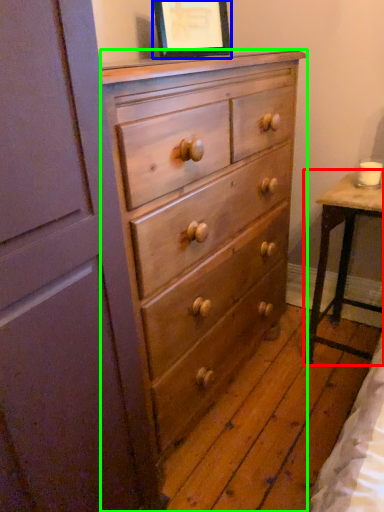
Question: Which object is positioned closest to table (highlighted by a red box)? Select from picture frame (highlighted by a blue box) and chest of drawers (highlighted by a green box).

Choices:
 (A) picture frame
 (B) chest of drawers

Answer: (B)